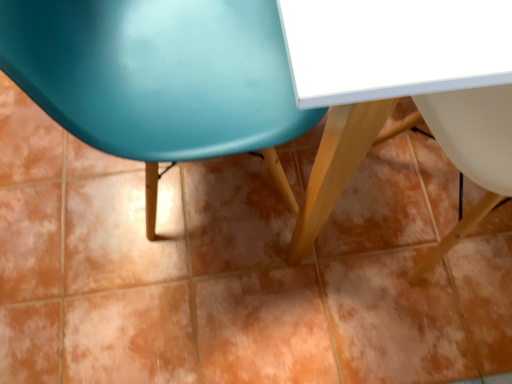
Question: Considering the positions of point (486, 112) and point (230, 150), is point (486, 112) closer or farther from the camera than point (230, 150)?

Choices:
 (A) farther
 (B) closer

Answer: (A)

Question: In terms of width, does white glossy table at center look wider or thinner when compared to matte plastic chair at upper left?

Choices:
 (A) wide
 (B) thin

Answer: (A)

Question: From their relative heights in the image, would you say white glossy table at center is taller or shorter than matte plastic chair at upper left?

Choices:
 (A) tall
 (B) short

Answer: (B)

Question: Choose the correct answer: Is matte plastic chair at upper left inside white glossy table at center or outside it?

Choices:
 (A) inside
 (B) outside

Answer: (B)

Question: In the image, is matte plastic chair at upper left positioned in front of or behind white glossy table at center?

Choices:
 (A) front
 (B) behind

Answer: (B)

Question: Is matte plastic chair at upper left bigger or smaller than white glossy table at center?

Choices:
 (A) small
 (B) big

Answer: (A)

Question: From a real-world perspective, relative to white glossy table at center, is matte plastic chair at upper left vertically above or below?

Choices:
 (A) below
 (B) above

Answer: (B)